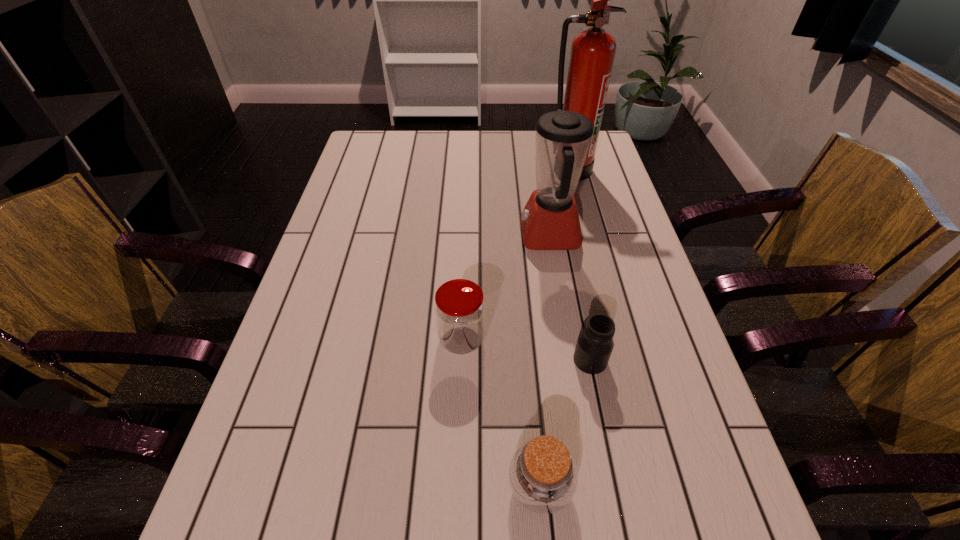
The width and height of the screenshot is (960, 540). In order to click on the tallest object in this screenshot , I will do `click(592, 55)`.

You are a GUI agent. You are given a task and a screenshot of the screen. Output one action in this format:
    pyautogui.click(x=<x>, y=<y>)
    Task: Click on the farthest object
    Image resolution: width=960 pixels, height=540 pixels.
    Given the screenshot: What is the action you would take?
    tap(592, 55)

This screenshot has height=540, width=960. What are the coordinates of `blender` in the screenshot? It's located at (549, 221).

Where is `the fourth shortest object`? The height and width of the screenshot is (540, 960). the fourth shortest object is located at coordinates coord(549,221).

At what (x,y) coordinates should I click in order to perform the action: click on the leftmost jar. Please return your answer as a coordinate pair (x, y). This screenshot has width=960, height=540. Looking at the image, I should click on (x=459, y=308).

Image resolution: width=960 pixels, height=540 pixels. What are the coordinates of `the leftmost object` in the screenshot? It's located at (459, 308).

Locate an element on the screen. the rightmost jar is located at coordinates (594, 346).

Where is `the nearest object`? The height and width of the screenshot is (540, 960). the nearest object is located at coordinates (543, 476).

Locate an element on the screen. This screenshot has width=960, height=540. the nearest jar is located at coordinates (543, 476).

The width and height of the screenshot is (960, 540). Identify the location of vacant space situated with the nozzle pointing from the back of the tallest object. (597, 269).